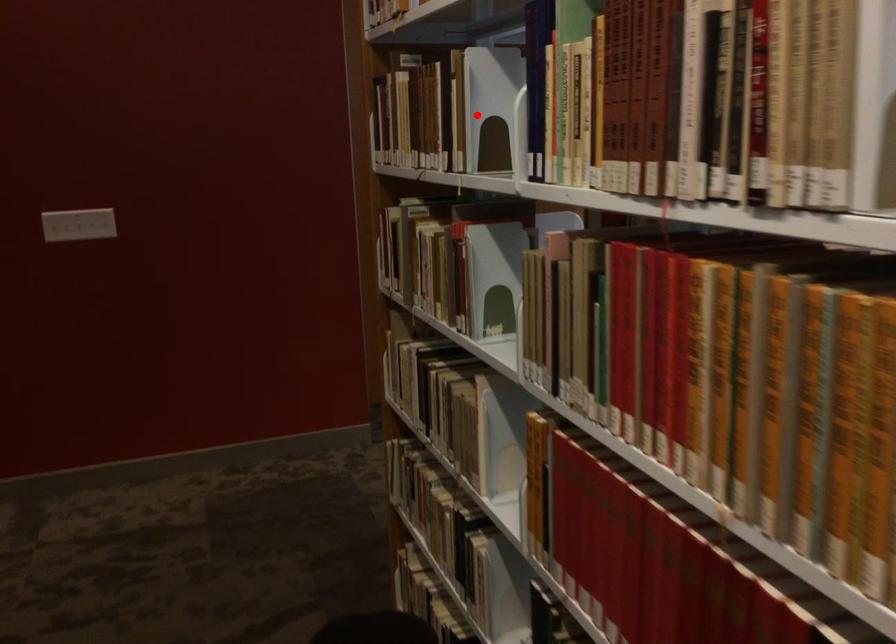
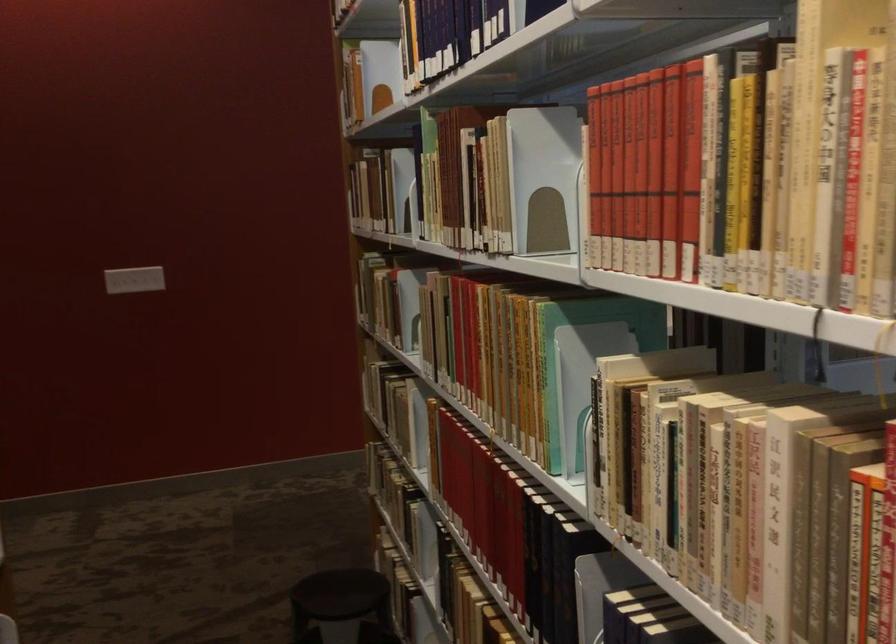
In the second image, find the point that corresponds to the highlighted location in the first image.

(400, 190)